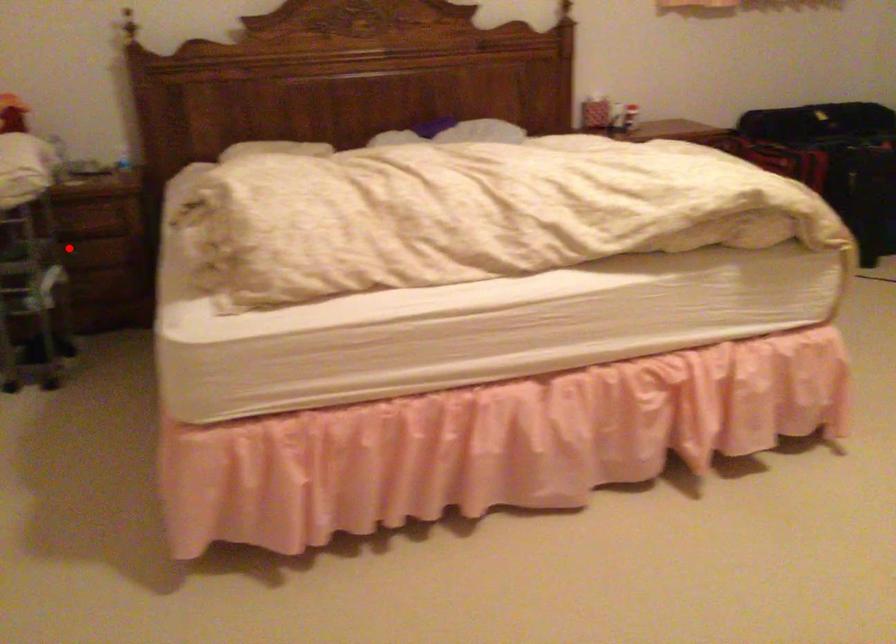
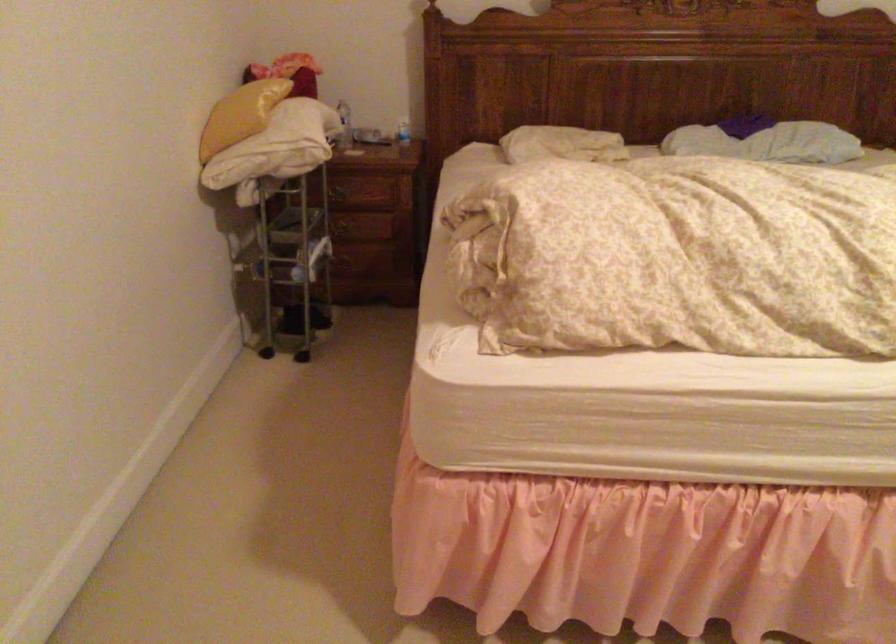
Where in the second image is the point corresponding to the highlighted location from the first image?

(342, 230)